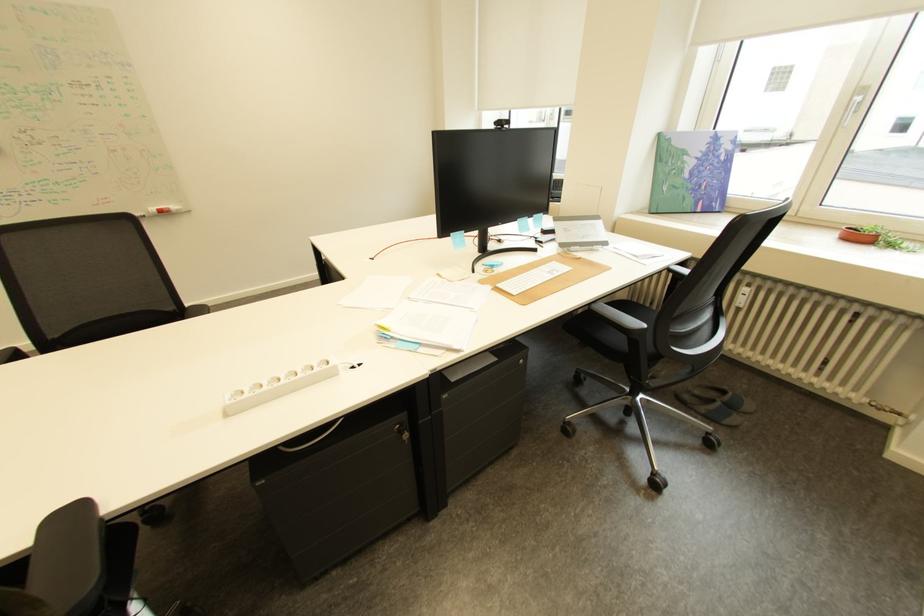
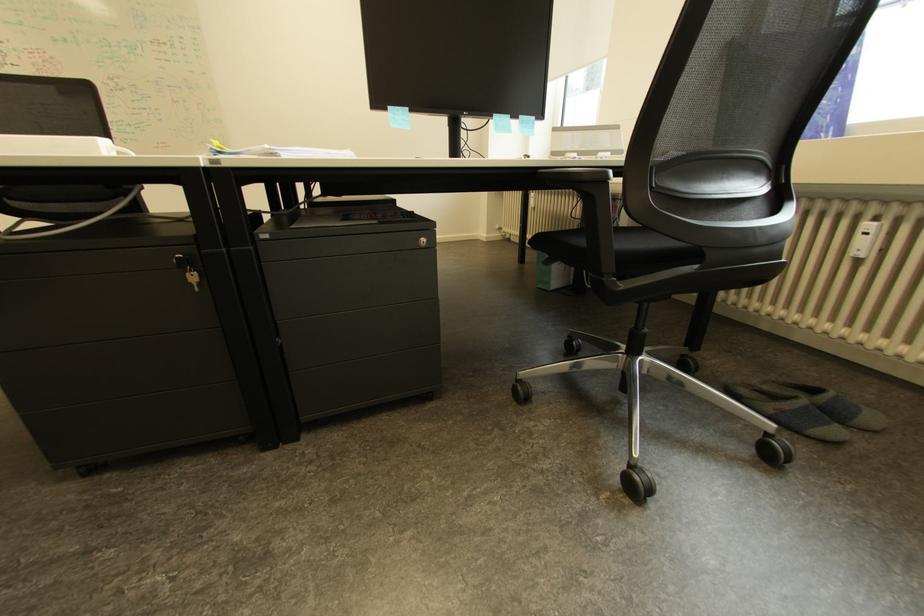
Question: Based on the continuous images, in which direction is the camera rotating? Reply with the corresponding letter.

Choices:
 (A) Left
 (B) Right
 (C) Up
 (D) Down

Answer: (A)